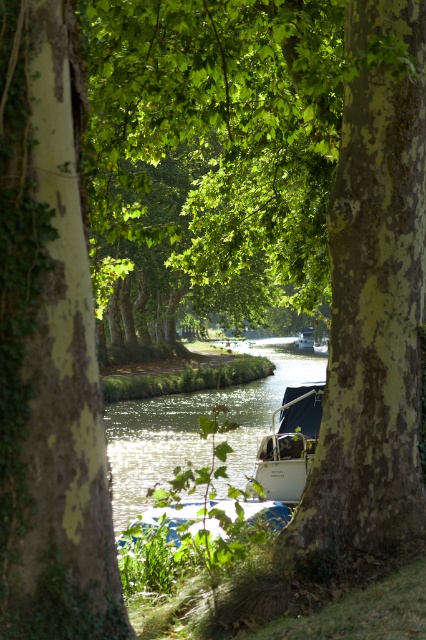
From the picture: Which is more to the right, white matte boat at center or white glossy boat at center?

white glossy boat at center is more to the right.

Consider the image. Is white matte boat at center taller than white glossy boat at center?

Incorrect, white matte boat at center's height is not larger of white glossy boat at center's.

Describe the element at coordinates (290, 444) in the screenshot. I see `white matte boat at center` at that location.

Locate an element on the screen. white matte boat at center is located at coordinates (290, 444).

Is point (22, 227) positioned behind point (296, 433)?

No.

Is green textured bark tree at center taller than white matte boat at center?

Correct, green textured bark tree at center is much taller as white matte boat at center.

Describe the element at coordinates (48, 349) in the screenshot. I see `green textured bark tree at center` at that location.

Image resolution: width=426 pixels, height=640 pixels. Find the location of `green textured bark tree at center`. green textured bark tree at center is located at coordinates (48, 349).

Can you confirm if green textured bark tree at center is thinner than white glossy boat at center?

Indeed, green textured bark tree at center has a lesser width compared to white glossy boat at center.

Find the location of a particular element. green textured bark tree at center is located at coordinates (48, 349).

Where is `green textured bark tree at center`? green textured bark tree at center is located at coordinates (48, 349).